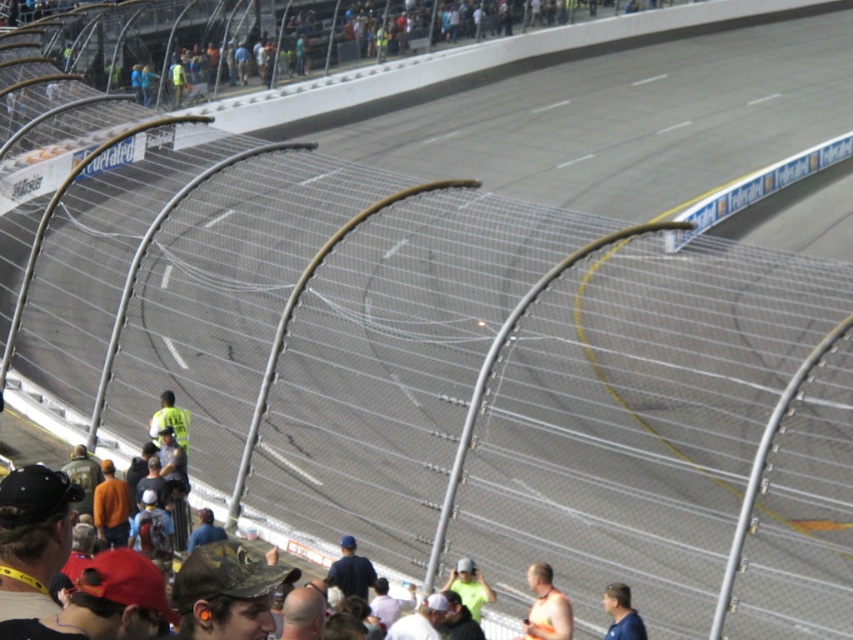
You are a photographer at the racetrack and want to capture both the blue shirt at lower center and the green fabric cap at center in a single shot. Given their sizes, which object should you focus on to ensure both are clearly visible in the frame?

Since the blue shirt at lower center occupies less space than the green fabric cap at center, you should focus on the green fabric cap at center to ensure both are clearly visible in the frame.

You are a photographer at the racetrack event. You need to capture a photo of the blue shirt at lower center and the green fabric cap at center. Which object should you focus on first if you want to ensure both are in sharp focus, considering their sizes?

The blue shirt at lower center is thinner than the green fabric cap at center, so you should focus on the green fabric cap at center first because it is larger and requires more precise focusing to ensure sharpness.

You are a photographer at the racetrack and want to capture a photo of the blue shirt at lower center and the green fabric cap at center. Which object should you focus on first if you want to include both in the frame without moving the camera?

The blue shirt at lower center should be focused on first because it is located below the green fabric cap at center, so adjusting the camera angle to include both would require ensuring the lower object is in frame first.